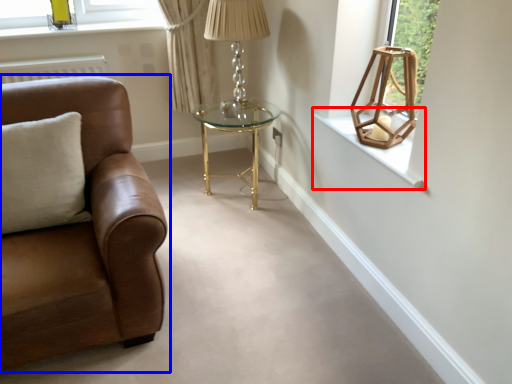
Question: Which point is closer to the camera, window sill (highlighted by a red box) or studio couch (highlighted by a blue box)?

Choices:
 (A) window sill
 (B) studio couch

Answer: (B)